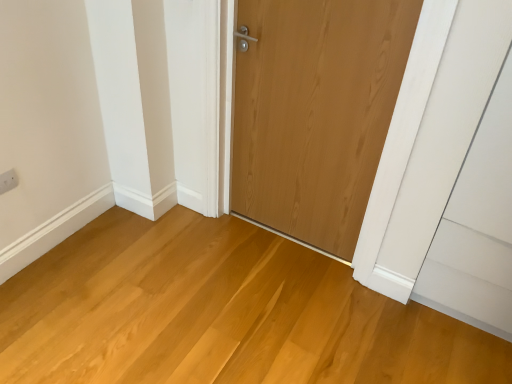
Question: Considering the relative sizes of natural wood floor at center and white plastic electric outlet at upper left in the image provided, is natural wood floor at center smaller than white plastic electric outlet at upper left?

Choices:
 (A) no
 (B) yes

Answer: (A)

Question: Considering the relative positions of natural wood floor at center and white plastic electric outlet at upper left in the image provided, is natural wood floor at center to the left of white plastic electric outlet at upper left from the viewer's perspective?

Choices:
 (A) yes
 (B) no

Answer: (B)

Question: Does natural wood floor at center have a lesser height compared to white plastic electric outlet at upper left?

Choices:
 (A) no
 (B) yes

Answer: (B)

Question: From a real-world perspective, is natural wood floor at center physically above white plastic electric outlet at upper left?

Choices:
 (A) yes
 (B) no

Answer: (B)

Question: Is natural wood floor at center positioned with its back to white plastic electric outlet at upper left?

Choices:
 (A) yes
 (B) no

Answer: (B)

Question: Choose the correct answer: Is white plastic electric outlet at upper left inside natural wood door at center or outside it?

Choices:
 (A) outside
 (B) inside

Answer: (A)

Question: Based on their positions, is white plastic electric outlet at upper left located to the left or right of natural wood door at center?

Choices:
 (A) right
 (B) left

Answer: (B)

Question: Considering the positions of point (10, 170) and point (366, 107), is point (10, 170) closer or farther from the camera than point (366, 107)?

Choices:
 (A) farther
 (B) closer

Answer: (A)

Question: Is white plastic electric outlet at upper left in front of or behind natural wood door at center in the image?

Choices:
 (A) front
 (B) behind

Answer: (B)

Question: Would you say white plastic electric outlet at upper left is to the left or to the right of natural wood floor at center in the picture?

Choices:
 (A) left
 (B) right

Answer: (A)

Question: Is white plastic electric outlet at upper left bigger or smaller than natural wood floor at center?

Choices:
 (A) small
 (B) big

Answer: (A)

Question: Does point (7, 187) appear closer or farther from the camera than point (322, 279)?

Choices:
 (A) farther
 (B) closer

Answer: (B)

Question: From the image's perspective, is white plastic electric outlet at upper left positioned above or below natural wood floor at center?

Choices:
 (A) below
 (B) above

Answer: (B)

Question: Is natural wood door at center inside the boundaries of white plastic electric outlet at upper left, or outside?

Choices:
 (A) inside
 (B) outside

Answer: (B)

Question: In the image, is natural wood door at center positioned in front of or behind white plastic electric outlet at upper left?

Choices:
 (A) front
 (B) behind

Answer: (A)